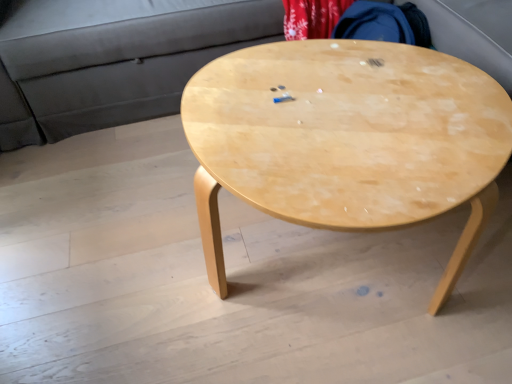
At what (x,y) coordinates should I click in order to perform the action: click on free spot below light wood/texture coffee table at center (from a real-world perspective). Please return your answer as a coordinate pair (x, y). The image size is (512, 384). Looking at the image, I should click on (347, 267).